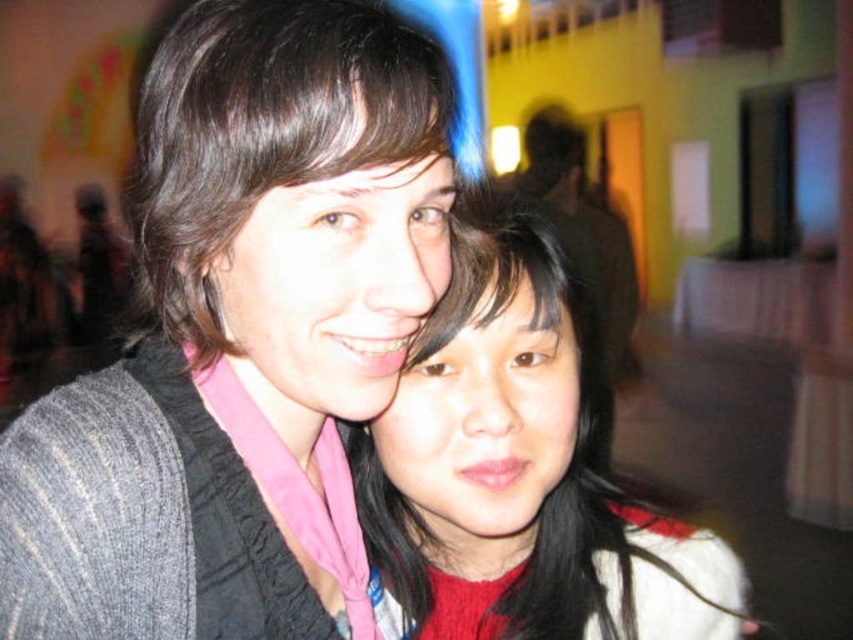
Based on the photo, between gray knitted sweater at upper left and matte black hair at upper left, which one is positioned higher?

matte black hair at upper left

Image resolution: width=853 pixels, height=640 pixels. What are the coordinates of `gray knitted sweater at upper left` in the screenshot? It's located at (236, 323).

Identify the location of gray knitted sweater at upper left. (236, 323).

This screenshot has height=640, width=853. Find the location of `gray knitted sweater at upper left`. gray knitted sweater at upper left is located at coordinates (236, 323).

Does gray knitted sweater at upper left have a lesser height compared to smooth black hair at center?

Incorrect, gray knitted sweater at upper left's height does not fall short of smooth black hair at center's.

Between point (161, 608) and point (419, 458), which one is positioned behind?

The point (419, 458) is more distant.

Where is `gray knitted sweater at upper left`? gray knitted sweater at upper left is located at coordinates (236, 323).

Is smooth black hair at center behind matte black hair at upper left?

Yes, it is.

Image resolution: width=853 pixels, height=640 pixels. What do you see at coordinates (520, 470) in the screenshot?
I see `smooth black hair at center` at bounding box center [520, 470].

Does point (648, 605) come farther from viewer compared to point (212, 211)?

Yes.

At what (x,y) coordinates should I click in order to perform the action: click on smooth black hair at center. Please return your answer as a coordinate pair (x, y). The image size is (853, 640). Looking at the image, I should click on (520, 470).